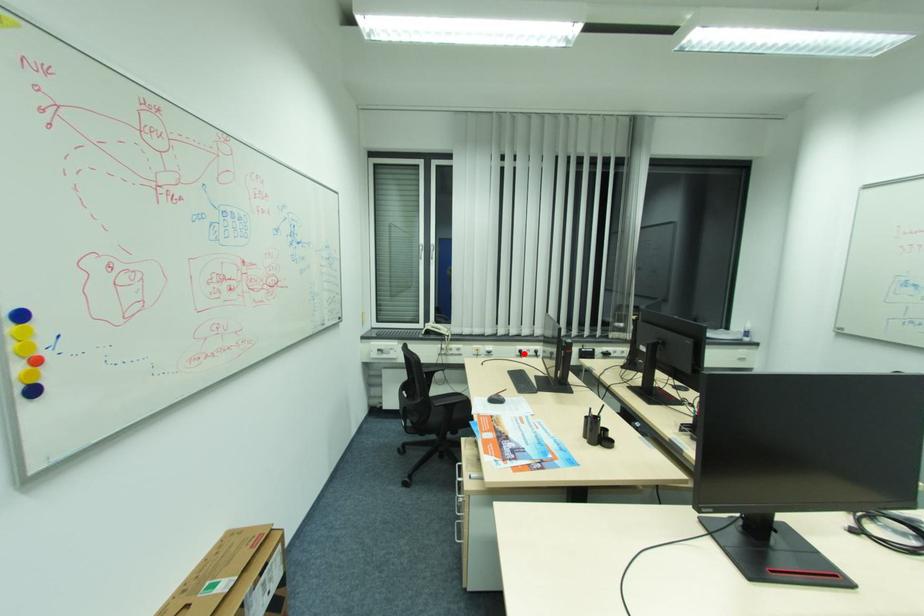
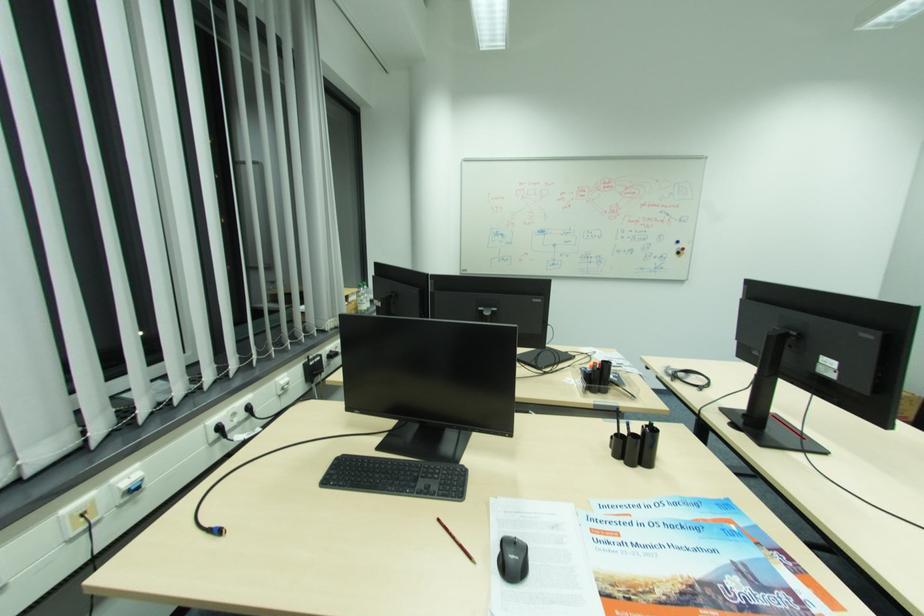
Question: I am providing you with two images of the same scene from different viewpoints. Image1 has a red point marked. In image2, the corresponding 3D location appears at what relative position? Reply with the corresponding letter.

Choices:
 (A) Closer
 (B) Farther

Answer: (A)